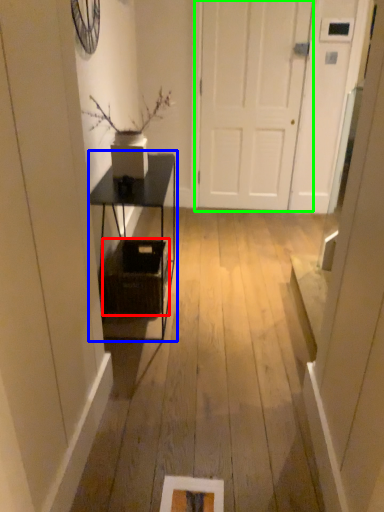
Question: Estimate the real-world distances between objects in this image. Which object is farther from basket (highlighted by a red box), table (highlighted by a blue box) or door (highlighted by a green box)?

Choices:
 (A) table
 (B) door

Answer: (B)